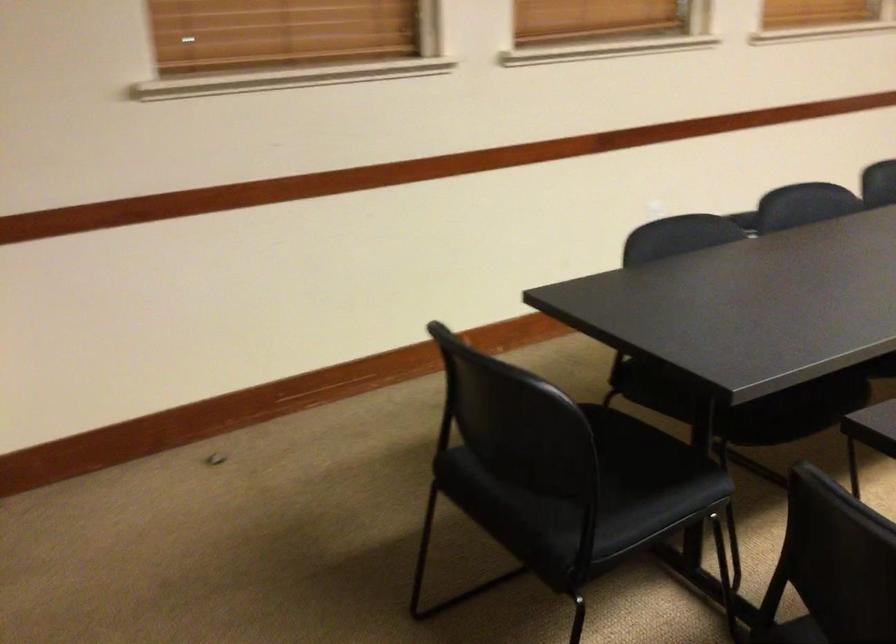
Find where to sit the black chair sitting surface. Please return your answer as a coordinate pair (x, y).

(641, 478)